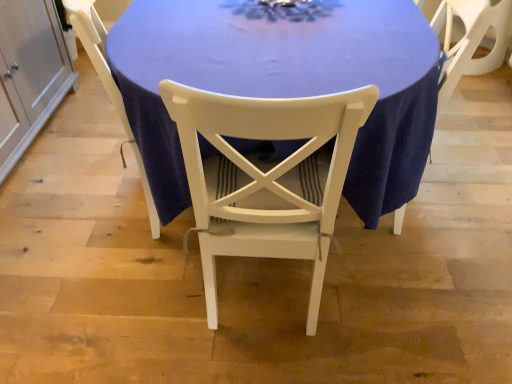
How much space does white wood chair at center, which ranks as the third chair in right-to-left order, occupy vertically?

37.98 inches.

The height and width of the screenshot is (384, 512). Describe the element at coordinates (284, 82) in the screenshot. I see `blue fabric table at center` at that location.

At what (x,y) coordinates should I click in order to perform the action: click on blue fabric table at center. Please return your answer as a coordinate pair (x, y). The width and height of the screenshot is (512, 384). Looking at the image, I should click on (284, 82).

What do you see at coordinates (464, 37) in the screenshot?
I see `white wood chair at center, the 1th chair positioned from the right` at bounding box center [464, 37].

Image resolution: width=512 pixels, height=384 pixels. I want to click on white wood chair at center, which ranks as the third chair in right-to-left order, so click(x=108, y=83).

Is white wood cabinet at left not near white wood chair at center, the 1th chair positioned from the right?

That's right, there is a large distance between white wood cabinet at left and white wood chair at center, the 1th chair positioned from the right.

Find the location of a particular element. The height and width of the screenshot is (384, 512). cabinetry on the left of the white wood chair at center, the 1th chair positioned from the right is located at coordinates click(x=31, y=71).

Between white wood cabinet at left and white wood chair at center, marked as the 3th chair in a left-to-right arrangement, which one appears on the right side from the viewer's perspective?

white wood chair at center, marked as the 3th chair in a left-to-right arrangement, is more to the right.

Considering the positions of points (348, 182) and (500, 3), is point (348, 182) closer to camera compared to point (500, 3)?

Yes.

Can you tell me how much blue fabric table at center and white wood chair at center, the 1th chair positioned from the right, differ in facing direction?

88.3 degrees separate the facing orientations of blue fabric table at center and white wood chair at center, the 1th chair positioned from the right.

Looking at their sizes, would you say blue fabric table at center is wider or thinner than white wood chair at center, the 1th chair positioned from the right?

Considering their sizes, blue fabric table at center looks broader than white wood chair at center, the 1th chair positioned from the right.

Is white wood chair at center, the 1th chair positioned from the right, far from white wood cabinet at left?

white wood chair at center, the 1th chair positioned from the right, is positioned a significant distance from white wood cabinet at left.

In the scene shown: Considering the relative positions of white wood chair at center, marked as the 3th chair in a left-to-right arrangement, and white wood cabinet at left in the image provided, is white wood chair at center, marked as the 3th chair in a left-to-right arrangement, to the right of white wood cabinet at left from the viewer's perspective?

Yes, white wood chair at center, marked as the 3th chair in a left-to-right arrangement, is to the right of white wood cabinet at left.

From the image's perspective, is white wood chair at center, the 1th chair positioned from the right, located above or below white wood cabinet at left?

From the image's perspective, white wood chair at center, the 1th chair positioned from the right, appears below white wood cabinet at left.

From a real-world perspective, between white wood chair at center, marked as the 3th chair in a left-to-right arrangement, and white wood cabinet at left, who is vertically lower?

From a 3D spatial view, white wood cabinet at left is below.

From the image's perspective, which is below, white wood chair at center, which ranks as the third chair in right-to-left order, or white painted wood chair at center, arranged as the 2th chair when viewed from the right?

white painted wood chair at center, arranged as the 2th chair when viewed from the right, appears lower in the image.

Is white wood chair at center, which ranks as the third chair in right-to-left order, oriented away from white painted wood chair at center, marked as the 2th chair in a left-to-right arrangement?

No, white wood chair at center, which ranks as the third chair in right-to-left order,'s orientation is not away from white painted wood chair at center, marked as the 2th chair in a left-to-right arrangement.

Which point is more forward, (83, 5) or (335, 131)?

The point (335, 131) is closer.

Is blue fabric table at center oriented towards white painted wood chair at center, marked as the 2th chair in a left-to-right arrangement?

Yes, blue fabric table at center is aimed at white painted wood chair at center, marked as the 2th chair in a left-to-right arrangement.

Is point (365, 34) closer or farther from the camera than point (194, 148)?

Point (365, 34).

Considering the relative sizes of blue fabric table at center and white painted wood chair at center, arranged as the 2th chair when viewed from the right, in the image provided, is blue fabric table at center smaller than white painted wood chair at center, arranged as the 2th chair when viewed from the right,?

No.

Does point (306, 253) lie behind point (393, 15)?

No.

Is the depth of white painted wood chair at center, arranged as the 2th chair when viewed from the right, less than that of blue fabric table at center?

Yes, white painted wood chair at center, arranged as the 2th chair when viewed from the right, is in front of blue fabric table at center.

Is white painted wood chair at center, marked as the 2th chair in a left-to-right arrangement, at the left side of blue fabric table at center?

Indeed, white painted wood chair at center, marked as the 2th chair in a left-to-right arrangement, is positioned on the left side of blue fabric table at center.

Is white painted wood chair at center, marked as the 2th chair in a left-to-right arrangement, not within blue fabric table at center?

No.

Which of these two, white painted wood chair at center, arranged as the 2th chair when viewed from the right, or white wood chair at center, marked as the 3th chair in a left-to-right arrangement, is bigger?

Bigger between the two is white painted wood chair at center, arranged as the 2th chair when viewed from the right.

Which of these two, white painted wood chair at center, marked as the 2th chair in a left-to-right arrangement, or white wood chair at center, the 1th chair positioned from the right, is thinner?

white wood chair at center, the 1th chair positioned from the right, is thinner.

Would you say white painted wood chair at center, marked as the 2th chair in a left-to-right arrangement, is inside or outside white wood chair at center, the 1th chair positioned from the right?

white painted wood chair at center, marked as the 2th chair in a left-to-right arrangement, cannot be found inside white wood chair at center, the 1th chair positioned from the right.

Locate an element on the screen. cabinetry lying on the left of white wood chair at center, marked as the 3th chair in a left-to-right arrangement is located at coordinates (x=31, y=71).

At what (x,y) coordinates should I click in order to perform the action: click on table that appears in front of the white wood chair at center, marked as the 3th chair in a left-to-right arrangement. Please return your answer as a coordinate pair (x, y). This screenshot has height=384, width=512. Looking at the image, I should click on (284, 82).

From the picture: Considering their positions, is blue fabric table at center positioned closer to white wood cabinet at left than white painted wood chair at center, marked as the 2th chair in a left-to-right arrangement?

The object closer to white wood cabinet at left is blue fabric table at center.

Estimate the real-world distances between objects in this image. Which object is further from white wood chair at center, marked as the 3th chair in a left-to-right arrangement, white wood chair at center, which ranks as the third chair in right-to-left order, or white wood cabinet at left?

white wood cabinet at left is further to white wood chair at center, marked as the 3th chair in a left-to-right arrangement.

Considering their positions, is white wood chair at center, which ranks as the third chair in right-to-left order, positioned closer to blue fabric table at center than white wood chair at center, the 1th chair positioned from the right?

white wood chair at center, which ranks as the third chair in right-to-left order, lies closer to blue fabric table at center than the other object.

Looking at the image, which one is located further to white wood chair at center, which ranks as the third chair in right-to-left order, white wood cabinet at left or blue fabric table at center?

Based on the image, white wood cabinet at left appears to be further to white wood chair at center, which ranks as the third chair in right-to-left order.

From the image, which object appears to be nearer to white wood chair at center, which ranks as the third chair in right-to-left order, white painted wood chair at center, arranged as the 2th chair when viewed from the right, or blue fabric table at center?

blue fabric table at center lies closer to white wood chair at center, which ranks as the third chair in right-to-left order, than the other object.

Estimate the real-world distances between objects in this image. Which object is closer to white wood cabinet at left, blue fabric table at center or white wood chair at center, which ranks as the third chair in right-to-left order?

white wood chair at center, which ranks as the third chair in right-to-left order.

Looking at the image, which one is located further to white wood chair at center, which ranks as the third chair in right-to-left order, white wood cabinet at left or white wood chair at center, marked as the 3th chair in a left-to-right arrangement?

Based on the image, white wood chair at center, marked as the 3th chair in a left-to-right arrangement, appears to be further to white wood chair at center, which ranks as the third chair in right-to-left order.

Considering their positions, is white painted wood chair at center, arranged as the 2th chair when viewed from the right, positioned closer to white wood chair at center, the 1th chair positioned from the right, than white wood cabinet at left?

white painted wood chair at center, arranged as the 2th chair when viewed from the right, is positioned closer to the anchor white wood chair at center, the 1th chair positioned from the right.

The image size is (512, 384). I want to click on table between white wood chair at center, which ranks as the third chair in right-to-left order, and white wood chair at center, marked as the 3th chair in a left-to-right arrangement, from left to right, so click(x=284, y=82).

Identify the location of chair located between white wood chair at center, which ranks as the third chair in right-to-left order, and blue fabric table at center in the left-right direction. (266, 177).

The height and width of the screenshot is (384, 512). I want to click on table between white wood cabinet at left and white wood chair at center, marked as the 3th chair in a left-to-right arrangement, so click(284, 82).

The width and height of the screenshot is (512, 384). What are the coordinates of `chair situated between white wood cabinet at left and white painted wood chair at center, arranged as the 2th chair when viewed from the right, from left to right` in the screenshot? It's located at (108, 83).